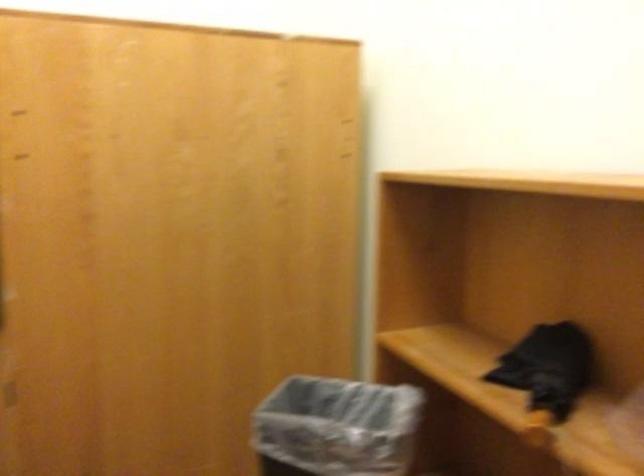
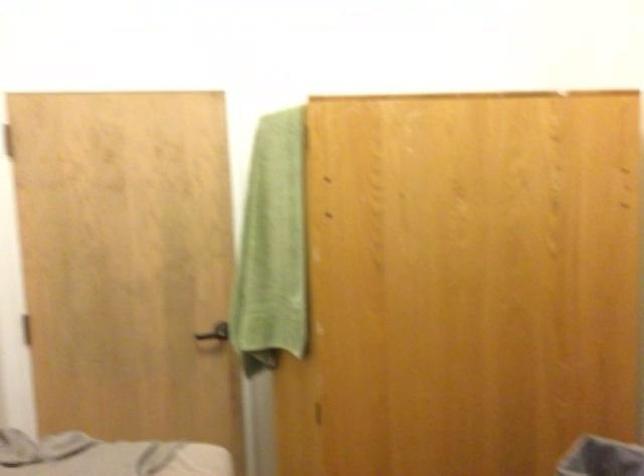
Question: The images are taken continuously from a first-person perspective. In which direction is your viewpoint rotating?

Choices:
 (A) Left
 (B) Right
 (C) Up
 (D) Down

Answer: (A)